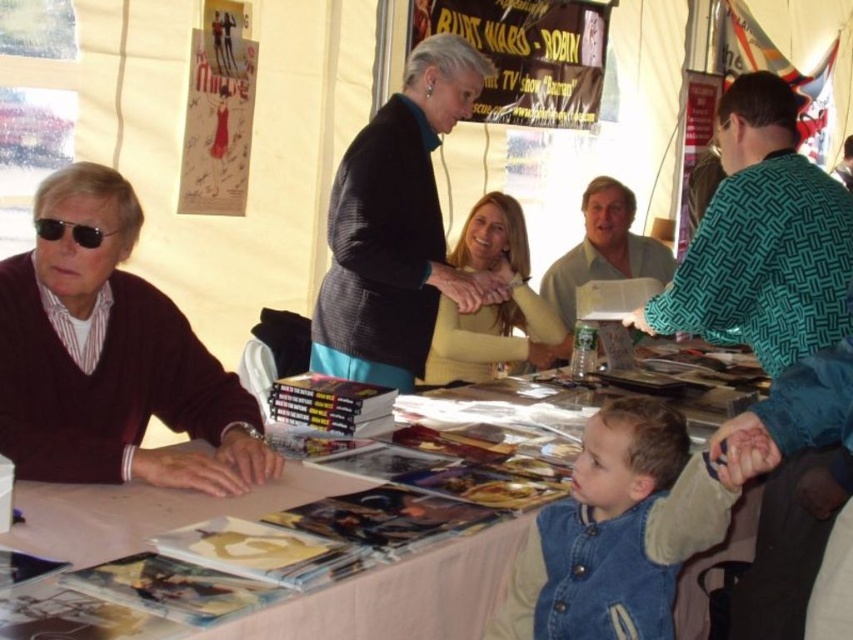
You are attending the event and want to take a photo of both the matte yellow sweater at center and the light green shirt at center. Which one should you focus on first to ensure both are in clear view?

You should focus on the matte yellow sweater at center first since it is closer to you than the light green shirt at center, allowing both to be in clear view when adjusting the focus accordingly.

Looking at this image, you are standing at the entrance of the tent and want to locate the green woven sweater at upper right. According to the coordinate system where the bottom left corner is origin, can you tell me its location?

The green woven sweater at upper right is located at coordinate point 0.375 on the x axis and 0.896 on the y axis.

You are a photographer at the event and need to capture a closeup shot of both the matte yellow sweater at center and the light green shirt at center in one frame. Can you fit both in the shot if your camera has a 60 cm wide lens view?

The matte yellow sweater at center and light green shirt at center are 67.23 centimeters apart. Since the distance between them exceeds the camera lens view of 60 cm, you cannot fit both in the shot.